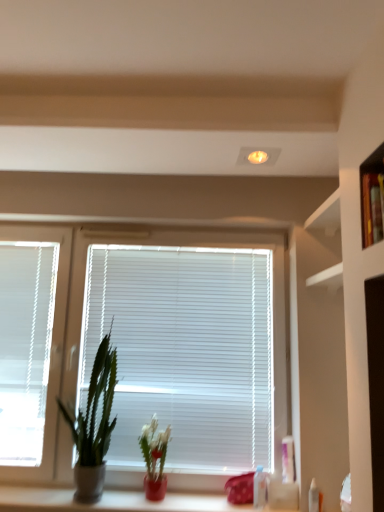
Find the location of `free space to the left of matte ceramic plant at lower center, which appears as the second houseplant when viewed from the left`. free space to the left of matte ceramic plant at lower center, which appears as the second houseplant when viewed from the left is located at coordinates (117, 495).